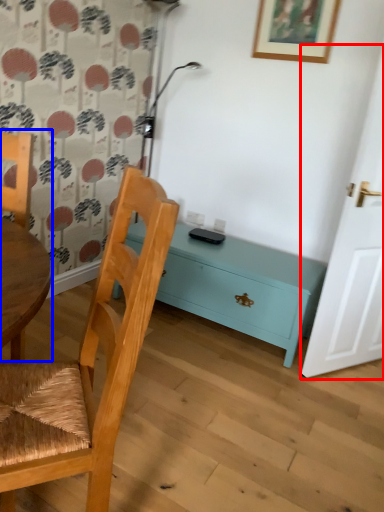
Question: Which point is further to the camera, door (highlighted by a red box) or chair (highlighted by a blue box)?

Choices:
 (A) door
 (B) chair

Answer: (A)